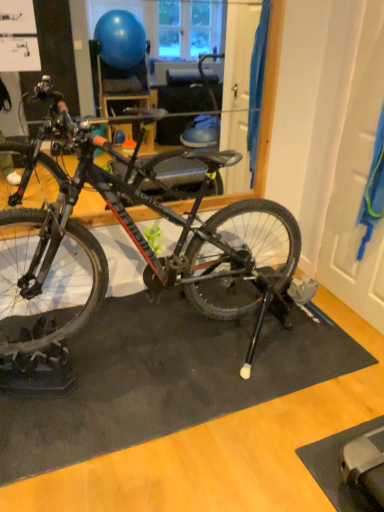
The height and width of the screenshot is (512, 384). Identify the location of blank space above black rubber doormat at center (from a real-world perspective). (170, 349).